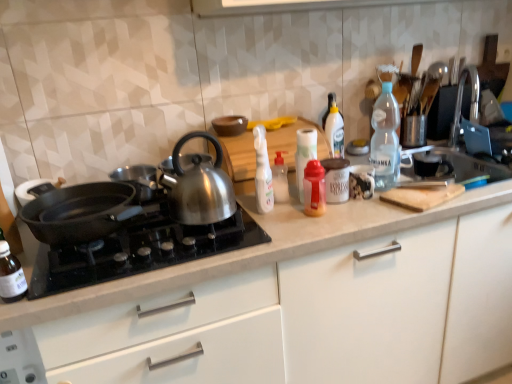
Question: Considering the relative sizes of white plastic spray bottle at center, the fifth bottle when ordered from right to left, and black matte pan at left in the image provided, is white plastic spray bottle at center, the fifth bottle when ordered from right to left, taller than black matte pan at left?

Choices:
 (A) yes
 (B) no

Answer: (A)

Question: Is white plastic spray bottle at center, the fifth bottle when ordered from right to left, aimed at black matte pan at left?

Choices:
 (A) no
 (B) yes

Answer: (A)

Question: Is white plastic spray bottle at center, which appears as the 2th bottle when viewed from the left, at the right side of black matte pan at left?

Choices:
 (A) yes
 (B) no

Answer: (A)

Question: Does white plastic spray bottle at center, which appears as the 2th bottle when viewed from the left, have a smaller size compared to black matte pan at left?

Choices:
 (A) yes
 (B) no

Answer: (A)

Question: Is white plastic spray bottle at center, which appears as the 2th bottle when viewed from the left, completely or partially outside of black matte pan at left?

Choices:
 (A) no
 (B) yes

Answer: (B)

Question: Is white plastic spray bottle at center, which appears as the 2th bottle when viewed from the left, thinner than black matte pan at left?

Choices:
 (A) yes
 (B) no

Answer: (A)

Question: From a real-world perspective, is translucent plastic bottle at center, the second bottle in the right-to-left sequence, physically below black matte pan at left?

Choices:
 (A) yes
 (B) no

Answer: (B)

Question: Is translucent plastic bottle at center, the second bottle in the right-to-left sequence, completely or partially outside of black matte pan at left?

Choices:
 (A) no
 (B) yes

Answer: (B)

Question: Is translucent plastic bottle at center, which is counted as the fifth bottle, starting from the left, facing away from black matte pan at left?

Choices:
 (A) yes
 (B) no

Answer: (B)

Question: Is the position of translucent plastic bottle at center, the second bottle in the right-to-left sequence, more distant than that of black matte pan at left?

Choices:
 (A) yes
 (B) no

Answer: (A)

Question: Does translucent plastic bottle at center, which is counted as the fifth bottle, starting from the left, have a greater width compared to black matte pan at left?

Choices:
 (A) no
 (B) yes

Answer: (A)

Question: Can you confirm if translucent plastic bottle at center, the second bottle in the right-to-left sequence, is shorter than black matte pan at left?

Choices:
 (A) yes
 (B) no

Answer: (B)

Question: From a real-world perspective, is transparent plastic bottle at lower left, arranged as the 1th bottle when viewed from the left, physically above shiny metallic kettle at center?

Choices:
 (A) yes
 (B) no

Answer: (B)